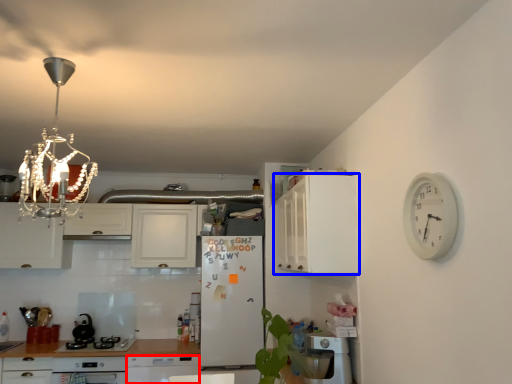
Question: Which object appears farthest to the camera in this image, dish washer (highlighted by a red box) or cabinetry (highlighted by a blue box)?

Choices:
 (A) dish washer
 (B) cabinetry

Answer: (A)